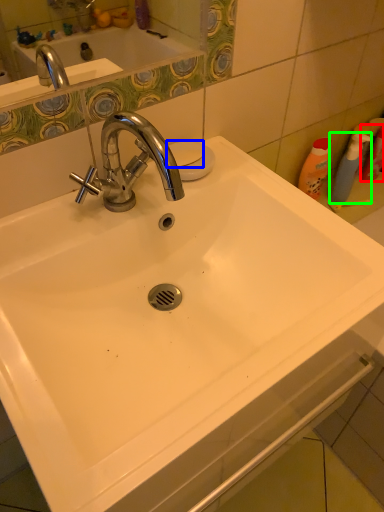
Question: Estimate the real-world distances between objects in this image. Which object is farther from cleaning product (highlighted by a red box), soap (highlighted by a blue box) or cleaning product (highlighted by a green box)?

Choices:
 (A) soap
 (B) cleaning product

Answer: (A)